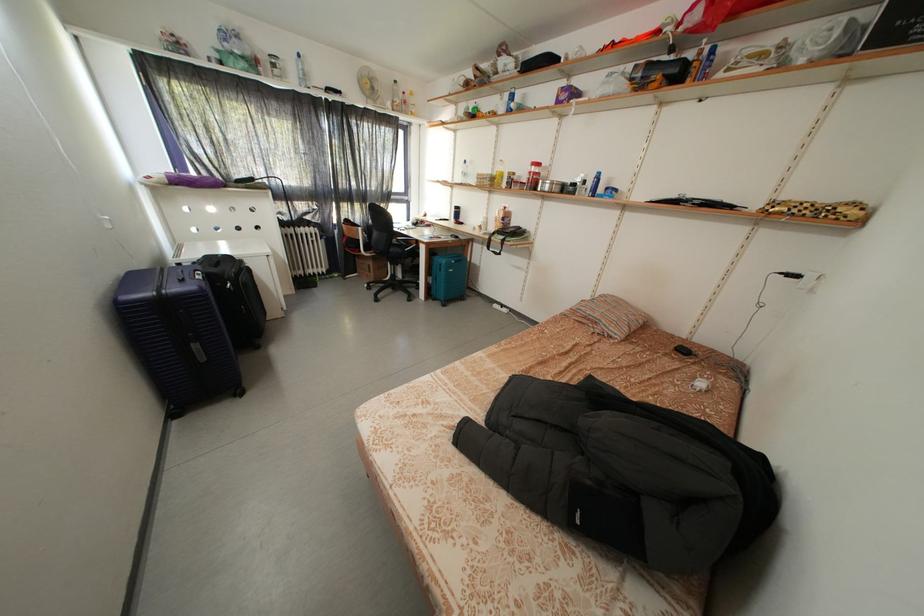
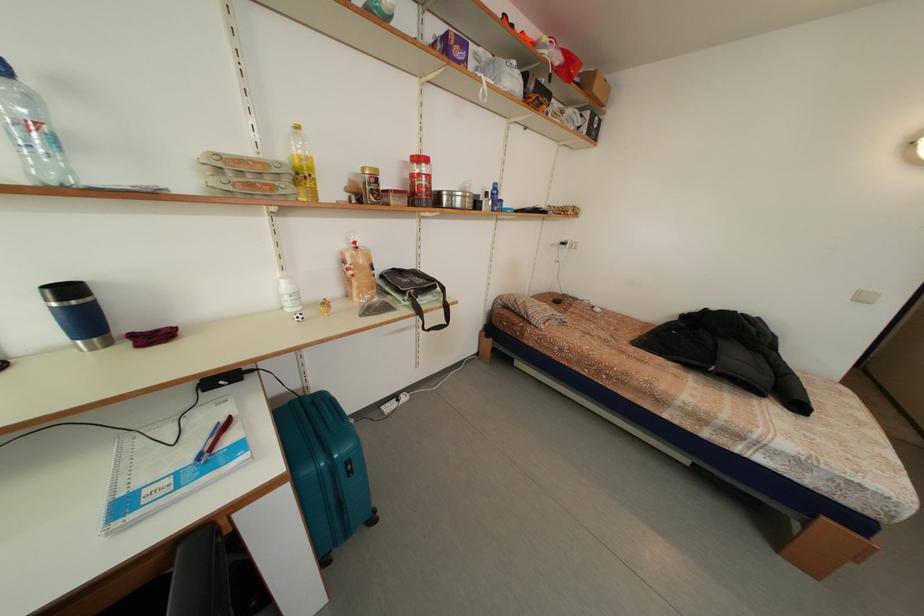
Locate, in the second image, the point that corresponds to (465,213) in the first image.

(78, 296)